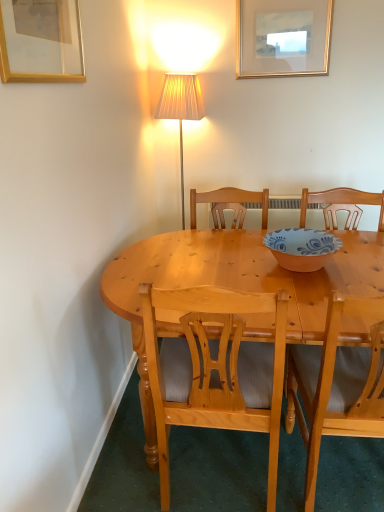
Question: From the image's perspective, is light brown wooden chair at center, marked as the first chair in a left-to-right arrangement, located above gold-framed picture at upper center, the second picture frame when ordered from bottom to top?

Choices:
 (A) no
 (B) yes

Answer: (A)

Question: Is gold-framed picture at upper center, the second picture frame when ordered from bottom to top, inside light brown wooden chair at center, marked as the first chair in a left-to-right arrangement?

Choices:
 (A) no
 (B) yes

Answer: (A)

Question: Can you confirm if light brown wooden chair at center, acting as the second chair starting from the right, is shorter than gold-framed picture at upper center, the second picture frame in the front-to-back sequence?

Choices:
 (A) no
 (B) yes

Answer: (A)

Question: Is light brown wooden chair at center, marked as the first chair in a left-to-right arrangement, wider than gold-framed picture at upper center, the second picture frame when ordered from bottom to top?

Choices:
 (A) no
 (B) yes

Answer: (B)

Question: From the image's perspective, is light brown wooden chair at center, marked as the first chair in a left-to-right arrangement, beneath gold-framed picture at upper center, positioned as the 1th picture frame in back-to-front order?

Choices:
 (A) no
 (B) yes

Answer: (B)

Question: From a real-world perspective, relative to blue and white ceramic bowl at center, is light wood chair at center, which ranks as the second chair in left-to-right order, vertically above or below?

Choices:
 (A) below
 (B) above

Answer: (A)

Question: Visually, is light wood chair at center, which ranks as the second chair in left-to-right order, positioned to the left or to the right of blue and white ceramic bowl at center?

Choices:
 (A) right
 (B) left

Answer: (A)

Question: Is light wood chair at center, placed as the 1th chair when sorted from right to left, wider or thinner than blue and white ceramic bowl at center?

Choices:
 (A) wide
 (B) thin

Answer: (A)

Question: Considering their positions, is light wood chair at center, which ranks as the second chair in left-to-right order, located in front of or behind blue and white ceramic bowl at center?

Choices:
 (A) front
 (B) behind

Answer: (A)

Question: From their relative heights in the image, would you say light brown wooden chair at center, acting as the second chair starting from the right, is taller or shorter than light wood chair at center, placed as the 1th chair when sorted from right to left?

Choices:
 (A) tall
 (B) short

Answer: (B)

Question: Based on their positions, is light brown wooden chair at center, acting as the second chair starting from the right, located to the left or right of light wood chair at center, which ranks as the second chair in left-to-right order?

Choices:
 (A) right
 (B) left

Answer: (B)

Question: Considering the positions of light brown wooden chair at center, marked as the first chair in a left-to-right arrangement, and light wood chair at center, which ranks as the second chair in left-to-right order, in the image, is light brown wooden chair at center, marked as the first chair in a left-to-right arrangement, bigger or smaller than light wood chair at center, which ranks as the second chair in left-to-right order,?

Choices:
 (A) big
 (B) small

Answer: (A)

Question: From the image's perspective, is light brown wooden chair at center, acting as the second chair starting from the right, above or below light wood chair at center, placed as the 1th chair when sorted from right to left?

Choices:
 (A) below
 (B) above

Answer: (B)

Question: From a real-world perspective, is light wood chair at center, placed as the 1th chair when sorted from right to left, positioned above or below gold/glass picture frame at upper left, which is counted as the first picture frame, starting from the bottom?

Choices:
 (A) above
 (B) below

Answer: (B)

Question: Does point (302, 399) appear closer or farther from the camera than point (34, 8)?

Choices:
 (A) farther
 (B) closer

Answer: (A)